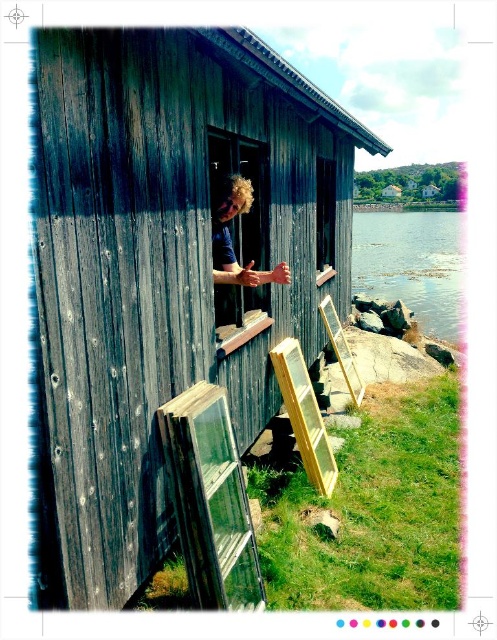
Question: Does weathered wood hut at center have a lesser width compared to wooden plank at center?

Choices:
 (A) no
 (B) yes

Answer: (B)

Question: Which of the following is the closest to the observer?

Choices:
 (A) (193, 410)
 (B) (322, 300)
 (C) (117, 496)

Answer: (C)

Question: Does clear water at lower right appear over wooden window at center?

Choices:
 (A) yes
 (B) no

Answer: (A)

Question: Does weathered wood hut at center appear on the right side of clear water at lower right?

Choices:
 (A) yes
 (B) no

Answer: (B)

Question: Considering the real-world distances, which object is closest to the weathered wood hut at center?

Choices:
 (A) wooden plank at center
 (B) clear water at lower right
 (C) wooden window at center
 (D) clear glass window at lower center

Answer: (C)

Question: Among these objects, which one is nearest to the camera?

Choices:
 (A) wooden plank at center
 (B) wooden window at center
 (C) clear water at lower right

Answer: (B)